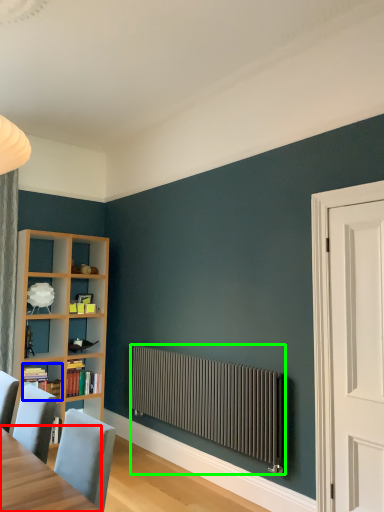
Question: Based on their relative distances, which object is farther from table (highlighted by a red box)? Choose from book (highlighted by a blue box) and radiator (highlighted by a green box).

Choices:
 (A) book
 (B) radiator

Answer: (A)